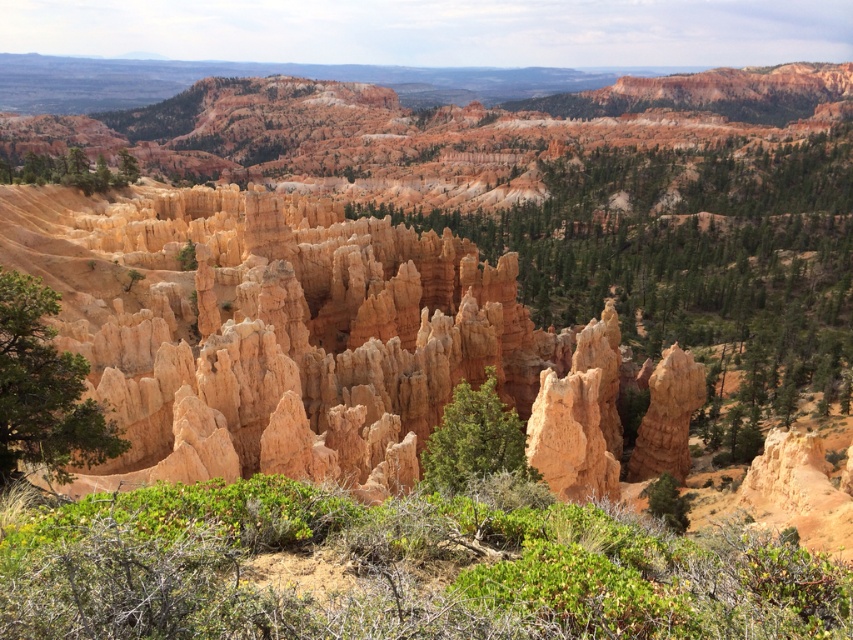
Consider the image. Does green leafy tree at left have a greater height compared to green leafy tree at upper left?

In fact, green leafy tree at left may be shorter than green leafy tree at upper left.

Based on the photo, can you confirm if green leafy tree at left is shorter than green leafy tree at upper left?

Correct, green leafy tree at left is not as tall as green leafy tree at upper left.

Which is in front, point (36, 284) or point (78, 164)?

Positioned in front is point (36, 284).

Locate an element on the screen. This screenshot has height=640, width=853. green leafy tree at left is located at coordinates (44, 388).

Who is higher up, green textured tree at center or green leafy tree at upper left?

Positioned higher is green leafy tree at upper left.

Who is more distant from viewer, (502, 452) or (51, 170)?

Positioned behind is point (51, 170).

This screenshot has width=853, height=640. I want to click on green textured tree at center, so click(x=473, y=440).

Find the location of `green textured tree at center`. green textured tree at center is located at coordinates (473, 440).

Which is behind, point (59, 365) or point (445, 467)?

Point (445, 467)

In order to click on green leafy tree at left in this screenshot , I will do `click(44, 388)`.

Where is `green leafy tree at left`? green leafy tree at left is located at coordinates (44, 388).